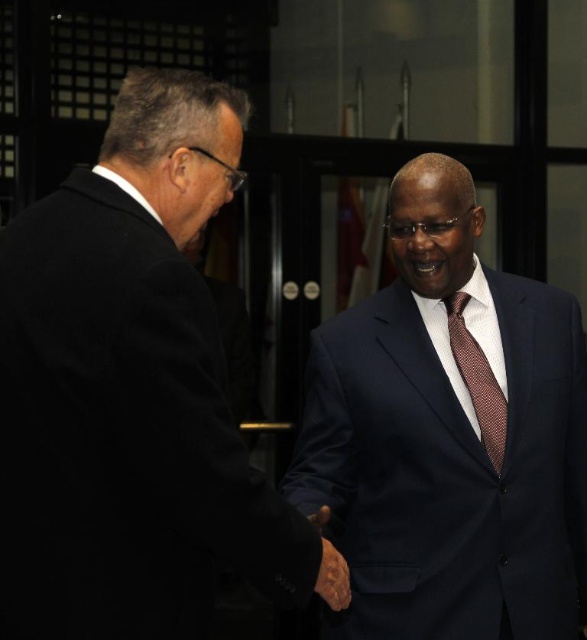
You are a photographer trying to capture a closeup shot of the handshake between the two men. You have a camera with a zoom lens that can focus on objects closer to you. Which point, point [66,609] or point [483,397], should you aim your camera at to get a clearer closeup of the handshake?

Point [66,609] is closer to the viewer than point [483,397], so you should aim your camera at point [66,609] to get a clearer closeup of the handshake.

You are attending a formal event and need to locate the man wearing a black suit at left and the person with a brown dotted tie at center. Based on the scene description, which object is positioned further to the left?

The black suit at left is positioned further to the left than the brown dotted tie at center.

You are standing in the room where the handshake is taking place. There are two points marked in the image, point (414,240) and point (495,428). Which point is closer to you?

Point (414,240) is further to the viewer than point (495,428), so the closer point to you is point (495,428).